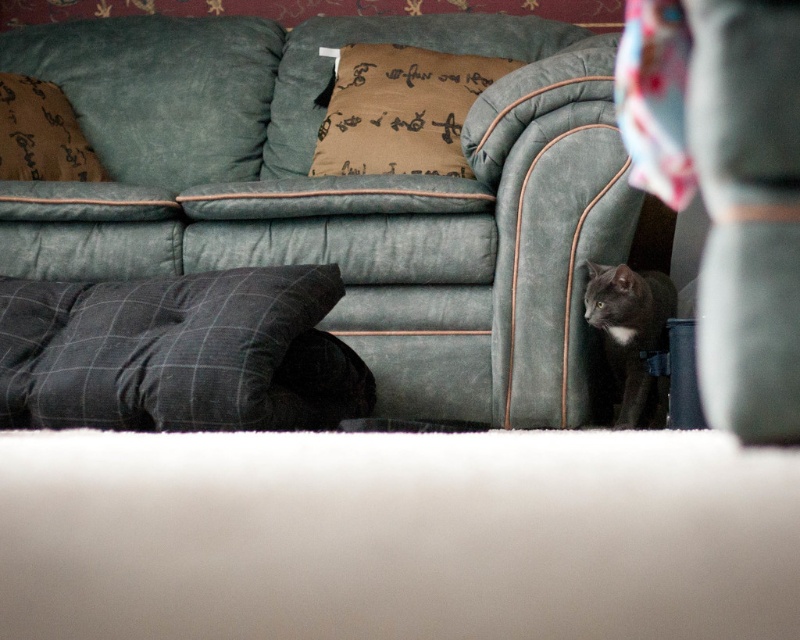
You are trying to decide which object is larger between the brown fabric pillow at upper center and the black fur cat at lower right. Based on the scene, which one is bigger?

The brown fabric pillow at upper center is bigger than the black fur cat at lower right according to the description.